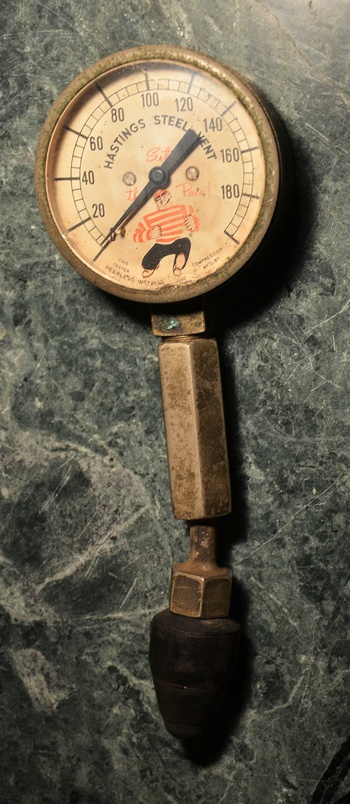
Where is `marble`? This screenshot has width=350, height=804. marble is located at coordinates (174, 797).